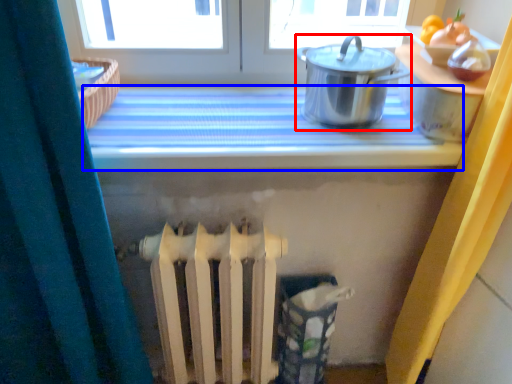
Question: Which object appears closest to the camera in this image, kitchen appliance (highlighted by a red box) or counter top (highlighted by a blue box)?

Choices:
 (A) kitchen appliance
 (B) counter top

Answer: (A)